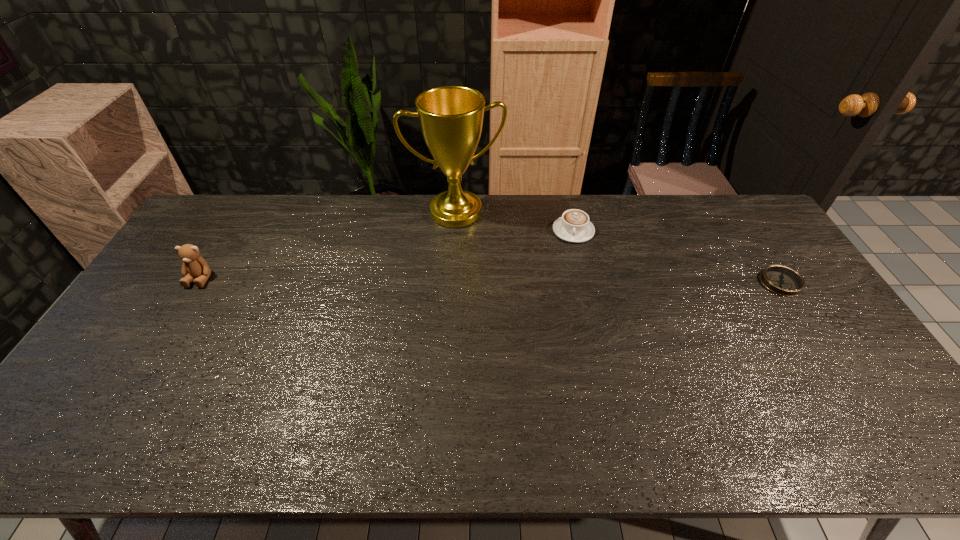
I want to click on the leftmost object, so click(x=194, y=265).

You are a GUI agent. You are given a task and a screenshot of the screen. Output one action in this format:
    pyautogui.click(x=<x>, y=<y>)
    Task: Click on the second tallest object
    The height and width of the screenshot is (540, 960).
    Given the screenshot: What is the action you would take?
    pyautogui.click(x=194, y=265)

You are a GUI agent. You are given a task and a screenshot of the screen. Output one action in this format:
    pyautogui.click(x=<x>, y=<y>)
    Task: Click on the compass
    
    Given the screenshot: What is the action you would take?
    pyautogui.click(x=784, y=281)

Where is `the shortest object`? the shortest object is located at coordinates (784, 281).

Where is `cappuccino`? The width and height of the screenshot is (960, 540). cappuccino is located at coordinates (x=574, y=226).

You are a GUI agent. You are given a task and a screenshot of the screen. Output one action in this format:
    pyautogui.click(x=<x>, y=<y>)
    Task: Click on the second shortest object
    The image size is (960, 540).
    Given the screenshot: What is the action you would take?
    pyautogui.click(x=574, y=226)

Where is `the tallest object`? Image resolution: width=960 pixels, height=540 pixels. the tallest object is located at coordinates (451, 117).

Image resolution: width=960 pixels, height=540 pixels. Find the location of `the second object from left to right`. the second object from left to right is located at coordinates (451, 117).

The width and height of the screenshot is (960, 540). I want to click on vacant region located on the front-facing side of the leftmost object, so click(157, 348).

Find the location of a particular element. This screenshot has height=540, width=960. vacant space located 0.370m on the left of the rightmost object is located at coordinates (641, 282).